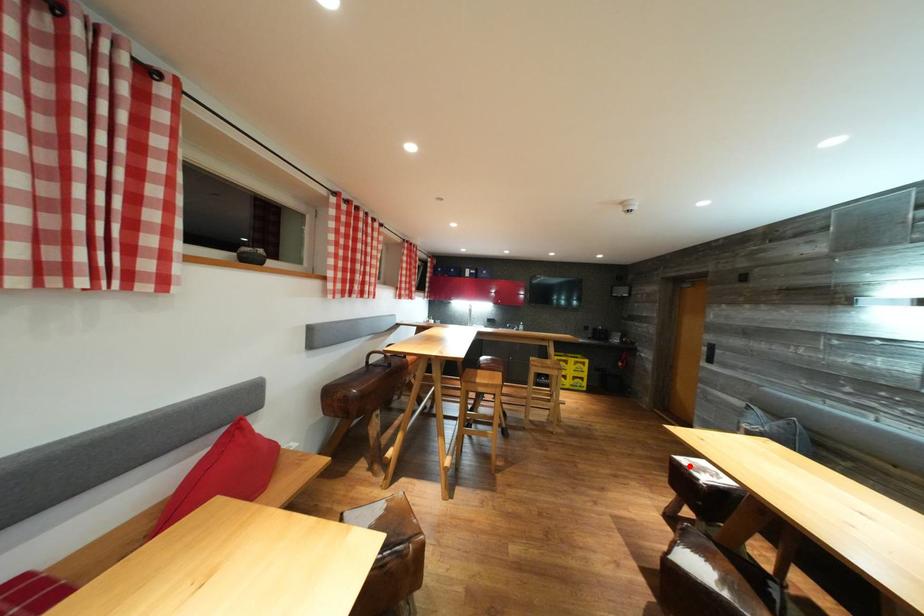
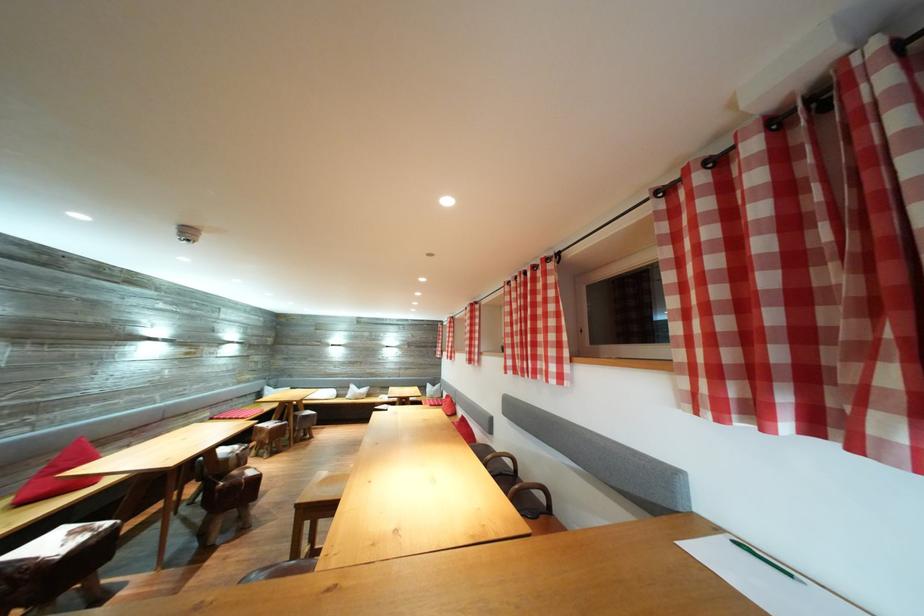
Question: I am providing you with two images of the same scene from different viewpoints. A red point is marked on the first image. Is the red point's position out of view in image 2?

Choices:
 (A) Yes
 (B) No

Answer: (A)